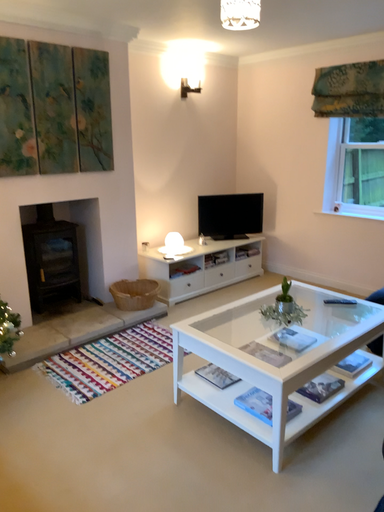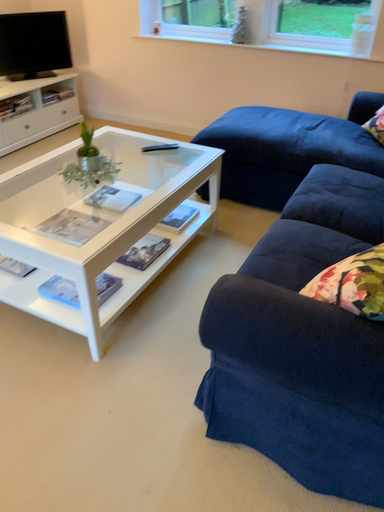
Question: Which way did the camera rotate in the video?

Choices:
 (A) rotated left
 (B) rotated right

Answer: (B)